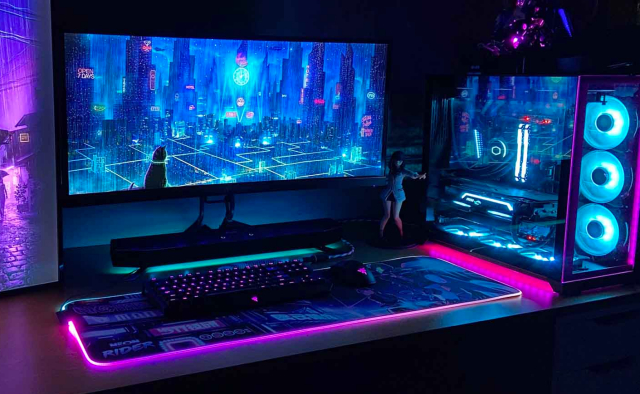
What are the coordinates of `plastic doll figure on a stand` in the screenshot? It's located at (388, 187).